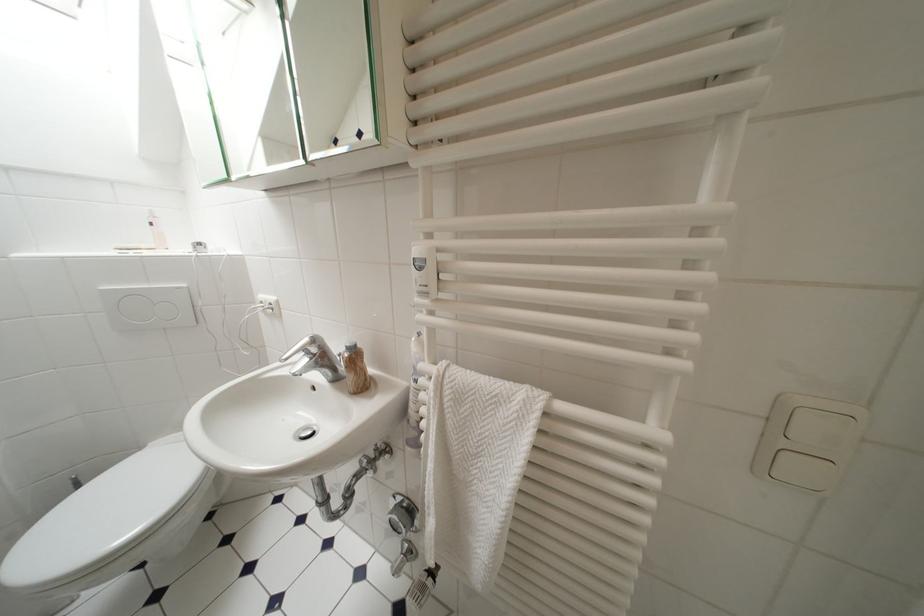
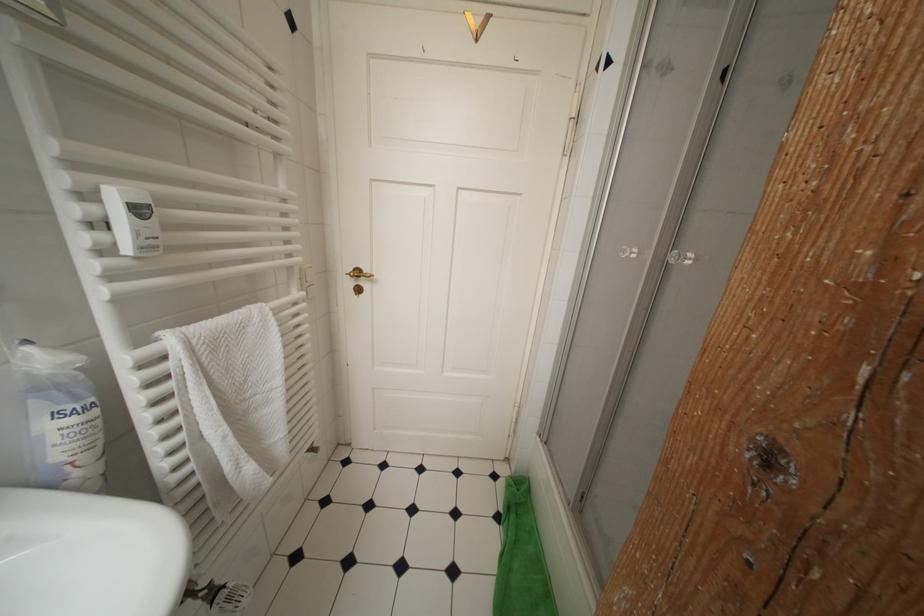
Based on the continuous images, in which direction is the camera rotating?

The camera rotated toward right-down.